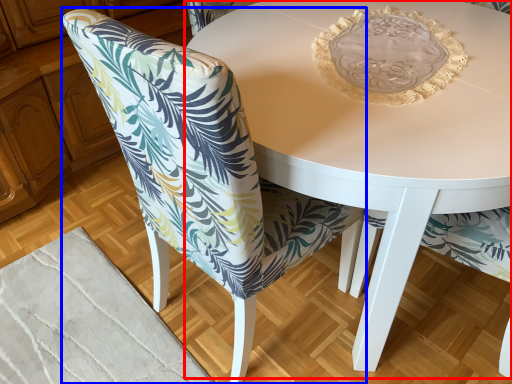
Question: Which point is closer to the camera, coffee table (highlighted by a red box) or chair (highlighted by a blue box)?

Choices:
 (A) coffee table
 (B) chair

Answer: (B)